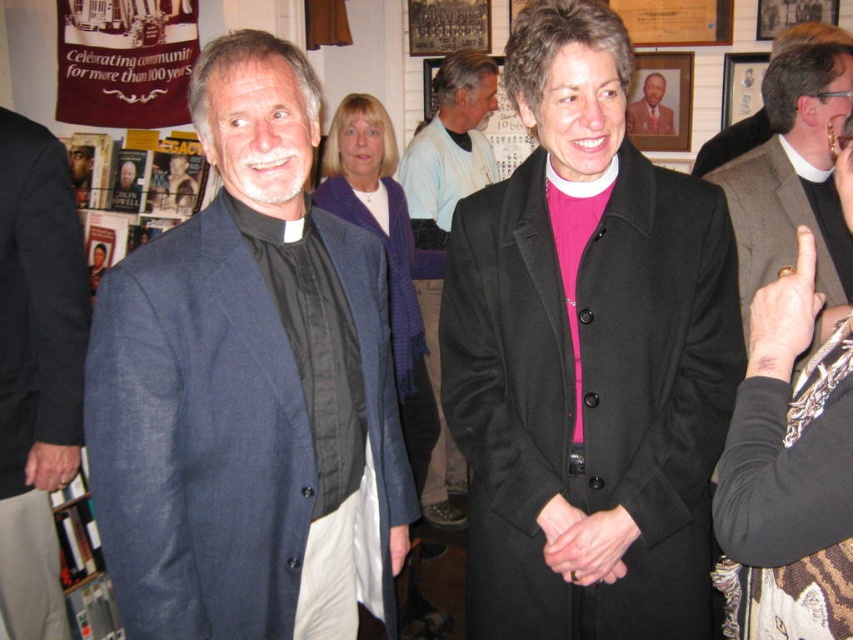
Question: Does matte black robe at upper right come in front of brown leather jacket at center?

Choices:
 (A) yes
 (B) no

Answer: (A)

Question: Among these objects, which one is farthest from the camera?

Choices:
 (A) light blue fabric shirt at center
 (B) gray wool vest at right

Answer: (A)

Question: Which object is closer to the camera taking this photo?

Choices:
 (A) matte black hand at lower left
 (B) smooth black coat at center

Answer: (B)

Question: Can you confirm if gold ring at upper right is positioned below brown leather jacket at center?

Choices:
 (A) yes
 (B) no

Answer: (A)

Question: Which object is farther from the camera taking this photo?

Choices:
 (A) blue linen suit at center
 (B) gray wool vest at right
 (C) dark blue suit at left
 (D) matte black robe at upper right

Answer: (D)

Question: Does matte black robe at upper right have a greater width compared to brown leather jacket at center?

Choices:
 (A) yes
 (B) no

Answer: (A)